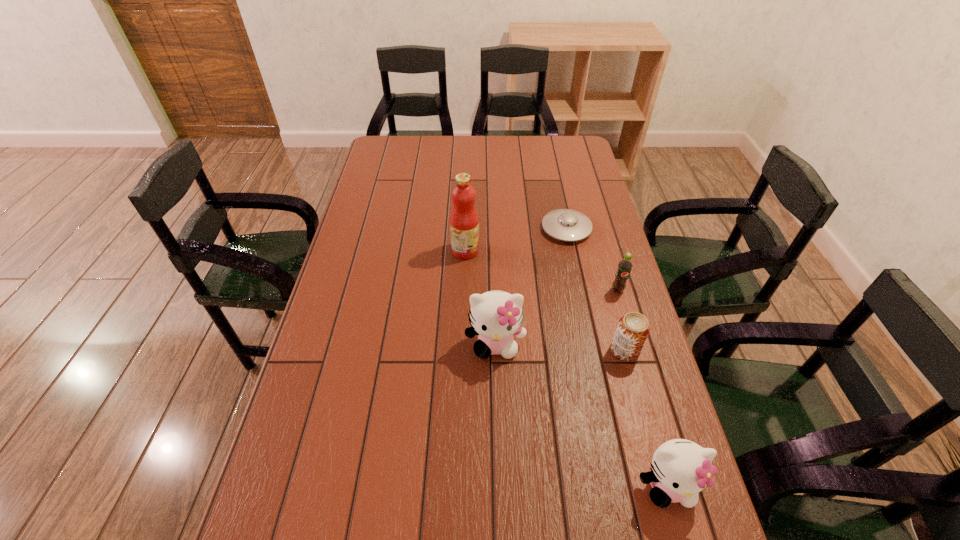
The width and height of the screenshot is (960, 540). Identify the location of vacant region between the taller kitten and the fourth nearest object. (557, 317).

The image size is (960, 540). I want to click on free spot between the left kitten and the beer can, so click(x=560, y=347).

Locate which object ranks fourth in proximity to the second tallest object. Please provide its 2D coordinates. Your answer should be formatted as a tuple, i.e. [(x, y)], where the tuple contains the x and y coordinates of a point satisfying the conditions above.

[(681, 469)]

Locate which object ranks second in proximity to the beer can. Please provide its 2D coordinates. Your answer should be formatted as a tuple, i.e. [(x, y)], where the tuple contains the x and y coordinates of a point satisfying the conditions above.

[(496, 316)]

Where is `vacant region that satisfies the following two spatial constraints: 1. on the front label of the fifth tallest object; 2. on the left side of the tallest object`? This screenshot has height=540, width=960. vacant region that satisfies the following two spatial constraints: 1. on the front label of the fifth tallest object; 2. on the left side of the tallest object is located at coordinates (462, 350).

This screenshot has height=540, width=960. Identify the location of vacant position in the image that satisfies the following two spatial constraints: 1. on the front label of the fruit juice; 2. on the back side of the beer can. (462, 350).

Identify the location of free space that satisfies the following two spatial constraints: 1. on the front label of the tallest object; 2. on the back side of the beer can. (462, 350).

Where is `free point that satisfies the following two spatial constraints: 1. on the front side of the shortest object; 2. on the left side of the beer can`? The width and height of the screenshot is (960, 540). free point that satisfies the following two spatial constraints: 1. on the front side of the shortest object; 2. on the left side of the beer can is located at coordinates (592, 350).